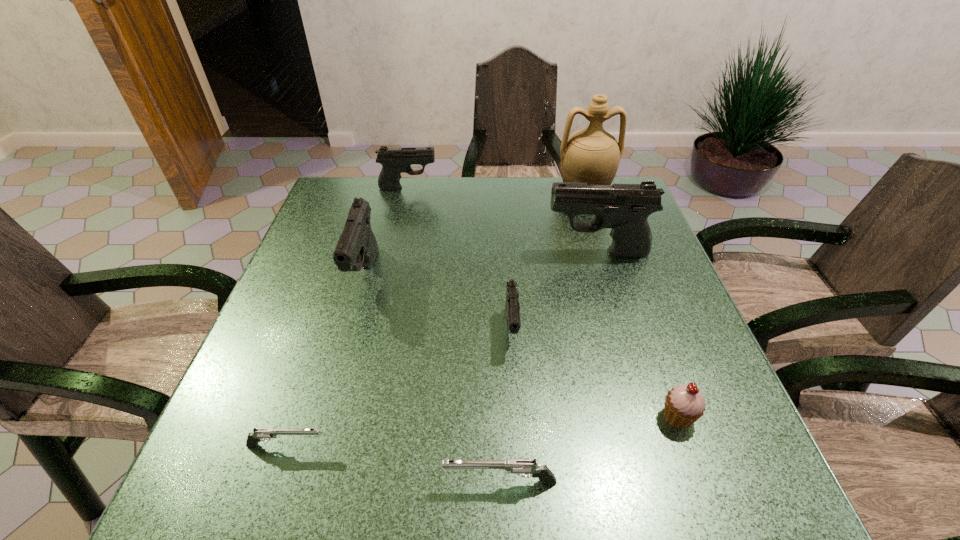
Find the location of a particular element. The image size is (960, 540). the nearest pistol is located at coordinates (522, 467).

Where is `the bigger silver pistol`? The image size is (960, 540). the bigger silver pistol is located at coordinates (522, 467).

The height and width of the screenshot is (540, 960). In order to click on the second nearest pistol in this screenshot , I will do `click(259, 434)`.

Where is `the seventh farthest object`? The height and width of the screenshot is (540, 960). the seventh farthest object is located at coordinates (259, 434).

This screenshot has height=540, width=960. Identify the location of vacant region located 0.300m on the left of the tallest object. (456, 192).

Identify the location of vacant region located 0.330m at the barrel of the seventh shortest object. This screenshot has width=960, height=540. (416, 253).

Locate an element on the screen. The height and width of the screenshot is (540, 960). free region located 0.130m at the barrel of the seventh shortest object is located at coordinates (494, 253).

What are the coordinates of `vacant area situated 0.350m at the barrel of the seventh shortest object` in the screenshot? It's located at (408, 253).

You are a GUI agent. You are given a task and a screenshot of the screen. Output one action in this format:
    pyautogui.click(x=<x>, y=<y>)
    Task: Click on the free point located 0.200m at the barrel of the fifth shortest pistol
    The width and height of the screenshot is (960, 540).
    Given the screenshot: What is the action you would take?
    pyautogui.click(x=334, y=386)

This screenshot has width=960, height=540. I want to click on vacant space located 0.140m at the barrel of the third tallest pistol, so click(x=483, y=187).